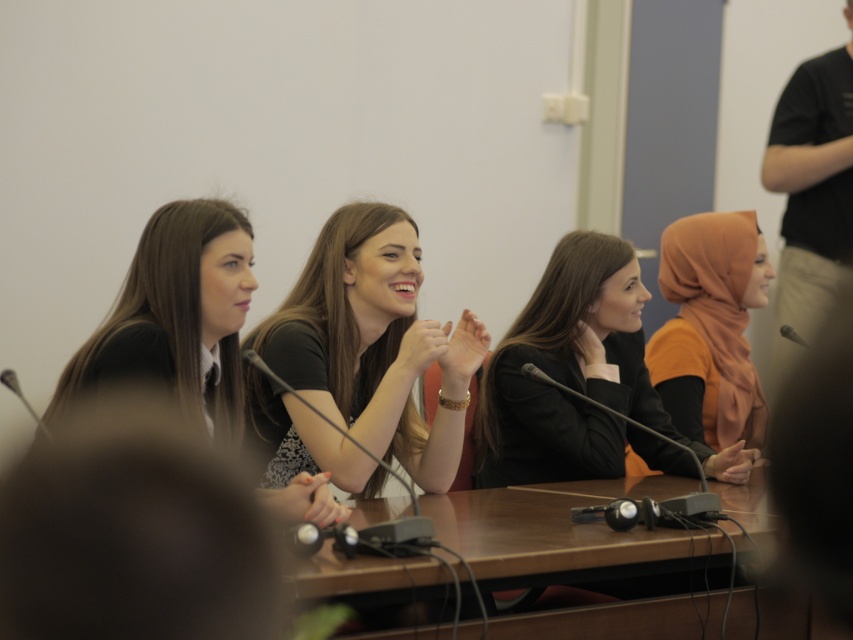
You are an event organizer arranging name tags for participants. You have two items to place name tags on the matte black jacket at center and the black matte shirt at left. Based on their positions, which item should you place the name tag higher up to ensure it is visible from the front row?

The black matte shirt at left should have the name tag placed higher up since the matte black jacket at center is positioned below it, making the shirt more visible from the front.